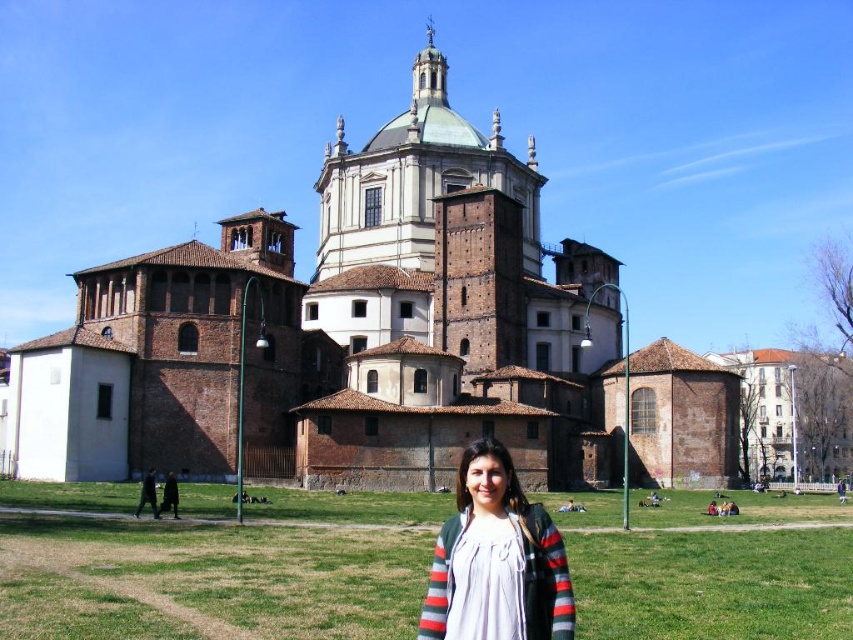
Question: Which object appears farthest from the camera in this image?

Choices:
 (A) brown brick church at center
 (B) white cotton shirt at lower center

Answer: (A)

Question: Is brown brick church at center smaller than white cotton shirt at lower center?

Choices:
 (A) no
 (B) yes

Answer: (A)

Question: Which point is closer to the camera?

Choices:
 (A) brown brick church at center
 (B) white cotton shirt at lower center

Answer: (B)

Question: Is brown brick church at center positioned before white cotton shirt at lower center?

Choices:
 (A) no
 (B) yes

Answer: (A)

Question: Does brown brick church at center appear over white cotton shirt at lower center?

Choices:
 (A) no
 (B) yes

Answer: (B)

Question: Among these points, which one is nearest to the camera?

Choices:
 (A) [x=544, y=625]
 (B) [x=207, y=474]

Answer: (A)